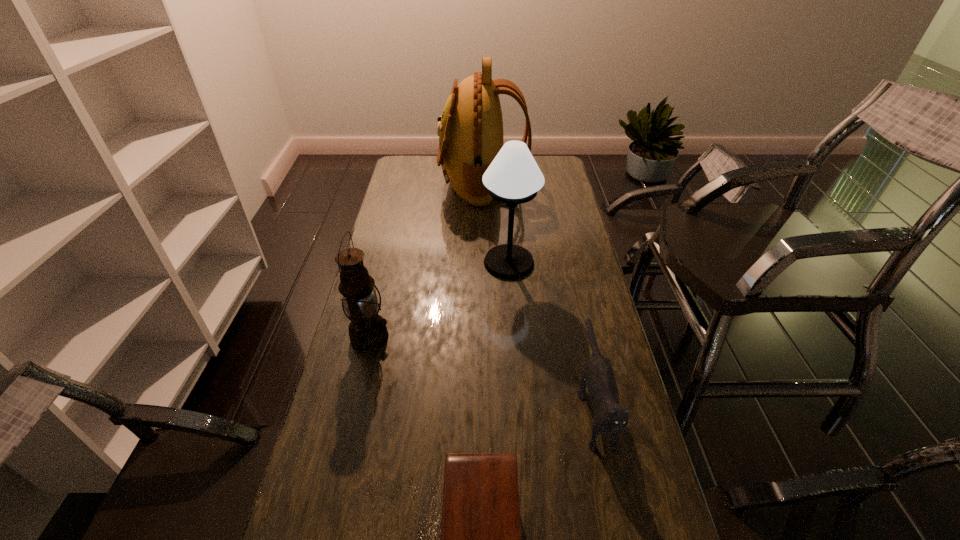
You are a GUI agent. You are given a task and a screenshot of the screen. Output one action in this format:
    pyautogui.click(x=<x>, y=<y>)
    Task: Click on the tallest object
    
    Given the screenshot: What is the action you would take?
    pyautogui.click(x=470, y=130)

Where is `the farthest object`? the farthest object is located at coordinates (470, 130).

The width and height of the screenshot is (960, 540). Identify the location of table lamp. (513, 177).

You are a GUI agent. You are given a task and a screenshot of the screen. Output one action in this format:
    pyautogui.click(x=<x>, y=<y>)
    Task: Click on the second farthest object
    This screenshot has width=960, height=540.
    Given the screenshot: What is the action you would take?
    pyautogui.click(x=513, y=177)

You are a GUI agent. You are given a task and a screenshot of the screen. Output one action in this format:
    pyautogui.click(x=<x>, y=<y>)
    Task: Click on the leftmost object
    The width and height of the screenshot is (960, 540).
    Given the screenshot: What is the action you would take?
    pyautogui.click(x=367, y=330)

Find the location of a particular element. Image resolution: width=960 pixels, height=540 pixels. the third shortest object is located at coordinates (367, 330).

Image resolution: width=960 pixels, height=540 pixels. Find the location of `the fourth tallest object`. the fourth tallest object is located at coordinates (609, 417).

Locate an element on the screen. cat is located at coordinates (609, 417).

You are a GUI agent. You are given a task and a screenshot of the screen. Output one action in this format:
    pyautogui.click(x=<x>, y=<y>)
    Task: Click on the free space located 0.140m on the front-facing side of the backpack
    This screenshot has height=540, width=960.
    Given the screenshot: What is the action you would take?
    pyautogui.click(x=409, y=183)

Where is `vacant space located 0.090m on the front-facing side of the backpack`? vacant space located 0.090m on the front-facing side of the backpack is located at coordinates (420, 183).